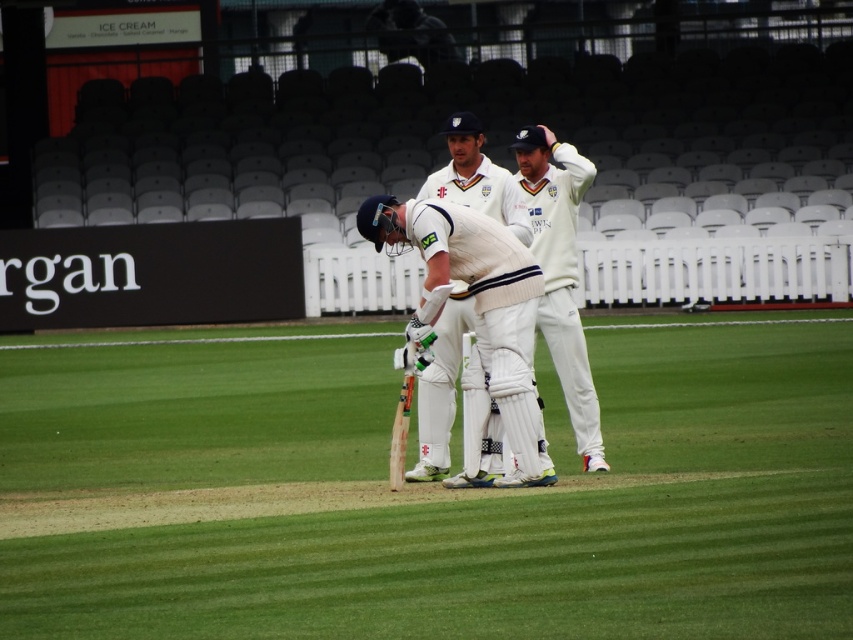
You are a new player joining the cricket team and need to position yourself exactly where the white textured cricket uniform at center is located. What are the coordinates you should aim for?

The coordinates for the white textured cricket uniform at center are at point (560, 273). You should aim for those coordinates.

From the picture: You are a drone operator assigned to capture aerial footage of the cricket match. Your drone is currently positioned at point 0.5, 0.5. You need to adjust it to focus on the white cotton cricket uniform at center. Which direction should you move the drone to get closer to the target?

The white cotton cricket uniform at center is located at point (x=469, y=294). Since the drone is at (x=426, y=320), you should move it slightly to the left and upwards to reach the target position.